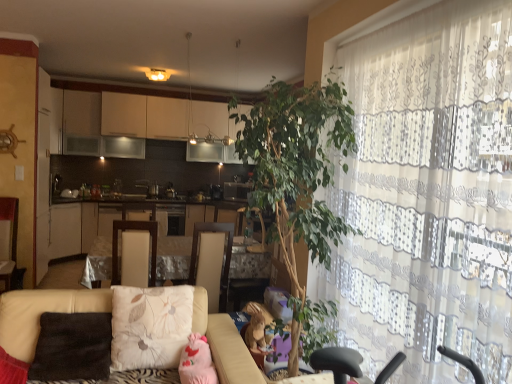
Question: From a real-world perspective, is green leafy plant at center physically located above or below satin silver microwave at center?

Choices:
 (A) below
 (B) above

Answer: (B)

Question: Is green leafy plant at center wider or thinner than satin silver microwave at center?

Choices:
 (A) wide
 (B) thin

Answer: (A)

Question: Considering the real-world distances, which object is farthest from the satin silver microwave at center?

Choices:
 (A) brown plush toy at lower center, which appears as the 2th toy when viewed from the left
 (B) wooden swivel chair at center, which is the 2th swivel chair from right to left
 (C) fluffy beige pillow at center, which is counted as the first pillow, starting from the right
 (D) satin black dishwasher at center
 (E) white glossy cabinets at center

Answer: (C)

Question: Which is nearer to the beige fabric couch at lower left?

Choices:
 (A) satin black dishwasher at center
 (B) beige fabric swivel chair at center, marked as the 2th swivel chair in a left-to-right arrangement
 (C) brown plush toy at lower center, which appears as the 1th toy when viewed from the right
 (D) wooden swivel chair at center, placed as the first swivel chair when sorted from left to right
 (E) white glossy cabinets at center

Answer: (C)